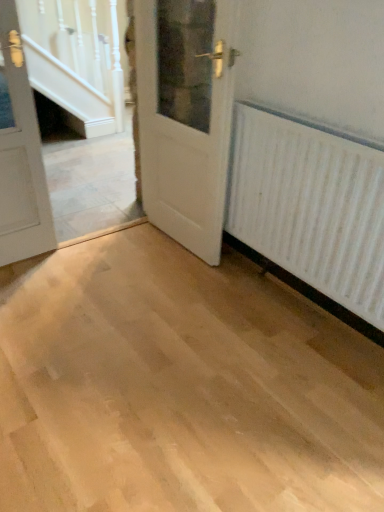
Locate an element on the screen. The image size is (384, 512). free space in front of white wood door at center, the 1th door positioned from the right is located at coordinates (169, 283).